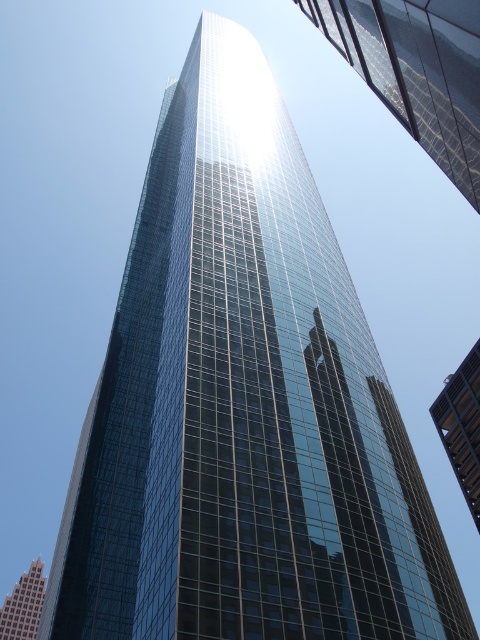
You are standing at the base of the glassy reflective skyscraper at center. Your friend is standing 100 meters away from the skyscraper. Who is closer to the building?

The glassy reflective skyscraper at center and the viewer are 70.80 meters apart, so you are closer to the building than your friend who is 100 meters away.

You are standing at the base of the skyscraper and want to take a photo of the point located at coordinate point (448, 438). Given that the distance from you to that point is 98.36 meters, is it possible for you to capture the entire skyscraper in a single photo without moving your position?

The distance between you and the point (448, 438) is 98.36 meters. Since the skyscraper is towering and the photo perspective is from a low angle looking upwards, capturing the entire skyscraper in one photo without moving might be challenging due to the height and the required field of view. However, the exact feasibility depends on the camera lens and sensor capabilities, which aren

You are standing at the center of the image and want to look at the shiny glass skyscraper at upper right. In which direction should you move your head to see it better?

Since the shiny glass skyscraper at upper right is located at point 0.111 on the x axis and 0.869 on the y axis, you should move your head to the upper right direction to see it better.